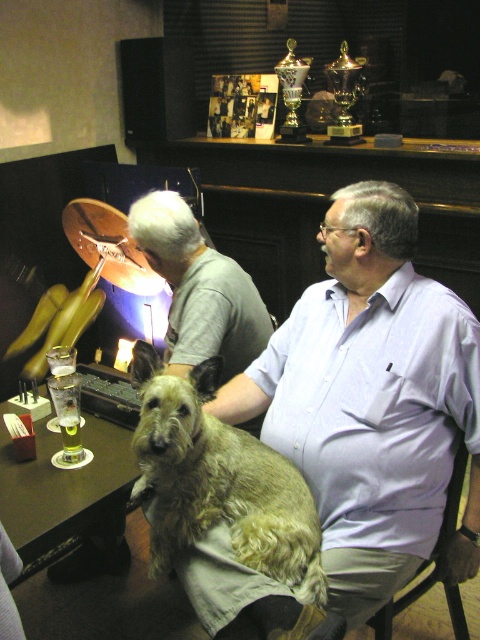
Which of these two, green glass at lower left or translucent glass beer at table left, stands shorter?

Standing shorter between the two is translucent glass beer at table left.

Who is more distant from viewer, (97, 444) or (60, 428)?

The point (97, 444) is more distant.

Locate an element on the screen. The image size is (480, 640). green glass at lower left is located at coordinates (64, 492).

Is gray cotton shirt at center to the left of green glass at lower left from the viewer's perspective?

Incorrect, gray cotton shirt at center is not on the left side of green glass at lower left.

Can you confirm if gray cotton shirt at center is smaller than green glass at lower left?

Actually, gray cotton shirt at center might be larger than green glass at lower left.

I want to click on gray cotton shirt at center, so click(199, 289).

What are the coordinates of `gray cotton shirt at center` in the screenshot? It's located at (199, 289).

Does fuzzy brown dog at center appear over green glass at lower left?

Yes, fuzzy brown dog at center is above green glass at lower left.

Is point (170, 426) in front of point (96, 538)?

Yes, it is in front of point (96, 538).

What do you see at coordinates (220, 481) in the screenshot? I see `fuzzy brown dog at center` at bounding box center [220, 481].

Locate an element on the screen. This screenshot has width=480, height=640. fuzzy brown dog at center is located at coordinates (220, 481).